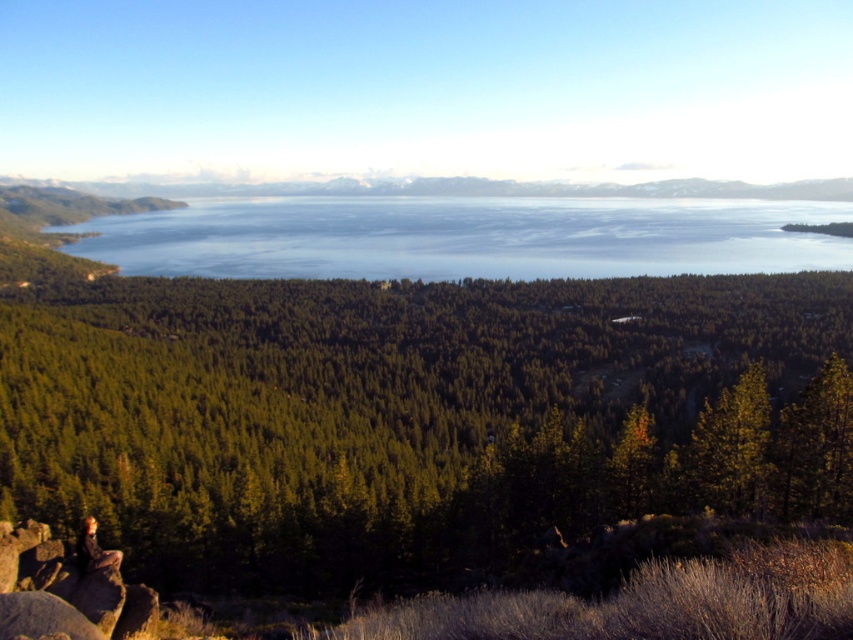
Does blue water at center appear under camouflage pants at lower left?

Actually, blue water at center is above camouflage pants at lower left.

Is point (756, 225) positioned before point (86, 563)?

No, (756, 225) is further to viewer.

Find the location of a particular element. blue water at center is located at coordinates (466, 237).

Is green matte tree at center behind blue water at center?

That is False.

This screenshot has height=640, width=853. Describe the element at coordinates (393, 416) in the screenshot. I see `green matte tree at center` at that location.

Locate an element on the screen. green matte tree at center is located at coordinates (393, 416).

Is green matte tree at center to the left of camouflage pants at lower left from the viewer's perspective?

Yes, green matte tree at center is to the left of camouflage pants at lower left.

Who is shorter, green matte tree at center or camouflage pants at lower left?

With less height is camouflage pants at lower left.

Locate an element on the screen. green matte tree at center is located at coordinates (x=393, y=416).